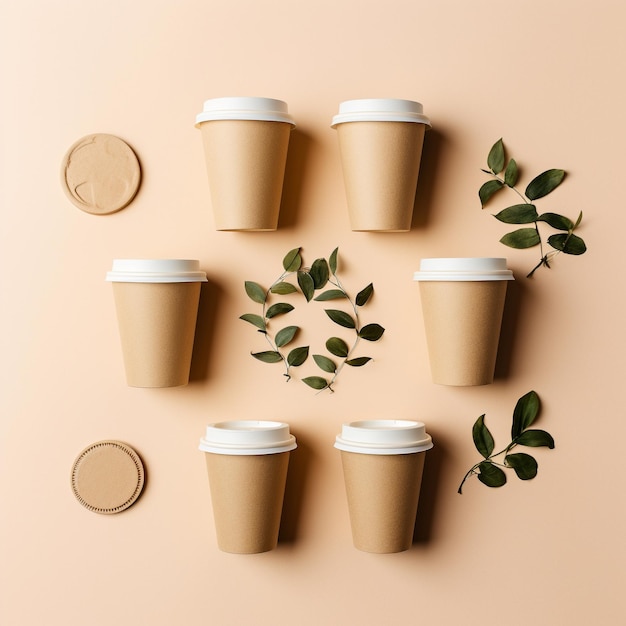
Locate an element on the screen. cups that look like coffee cups is located at coordinates (171, 326), (250, 464), (398, 483), (463, 341), (357, 183), (245, 193).